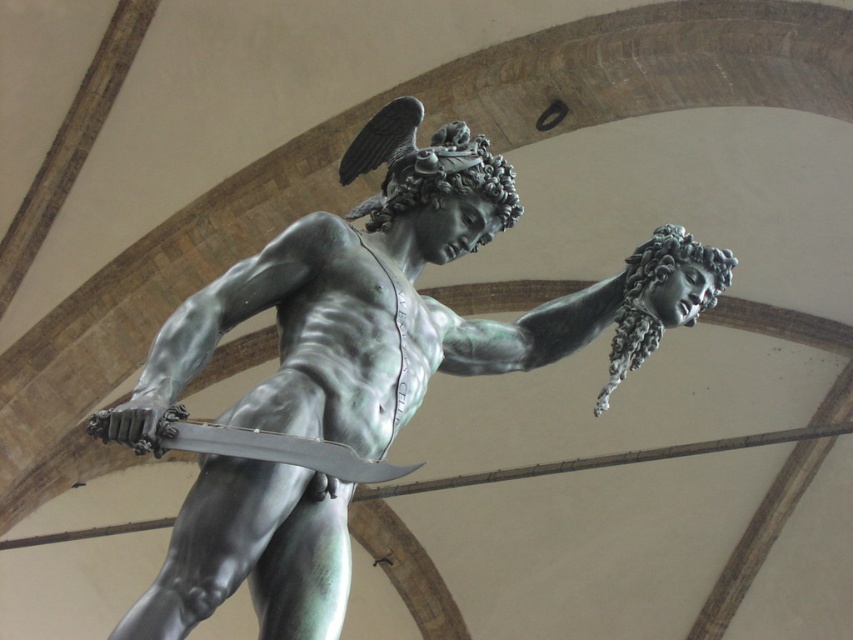
You are standing in front of the bronze sculpture of Perseus holding Medusa. You want to take a photo of the point at coordinate point [222,593]. The camera you are using has a maximum focus range of 25 meters. Will the camera be able to focus on that point?

The point at coordinate point [222,593] is 28.53 meters away from the camera. Since the camera can only focus up to 25 meters, it will not be able to focus on that point.

You are a photographer standing at a certain distance from the green patina bronze statue at center. You want to capture a full view of the statue without any distortion. According to the rule of thumb, the minimum distance to avoid distortion when photographing statues is 80 feet. Can you take the photo from your current position?

The green patina bronze statue at center and camera are 89.68 feet apart from each other. Since 89.68 feet is greater than the minimum required 80 feet, you can take the photo from your current position without distortion.

You are a museum curator who needs to install a protective glass barrier around the green patina bronze statue at center and the polished bronze sword at center. The barrier must be placed 2 meters away from both objects to ensure safety. Is there enough space between the two objects to accommodate this requirement?

The distance between the green patina bronze statue at center and the polished bronze sword at center is 4.15 meters. To place the barrier 2 meters away from both, the total required space would be 4 meters. Since 4.15 meters is greater than 4 meters, there is sufficient space to install the barrier safely.